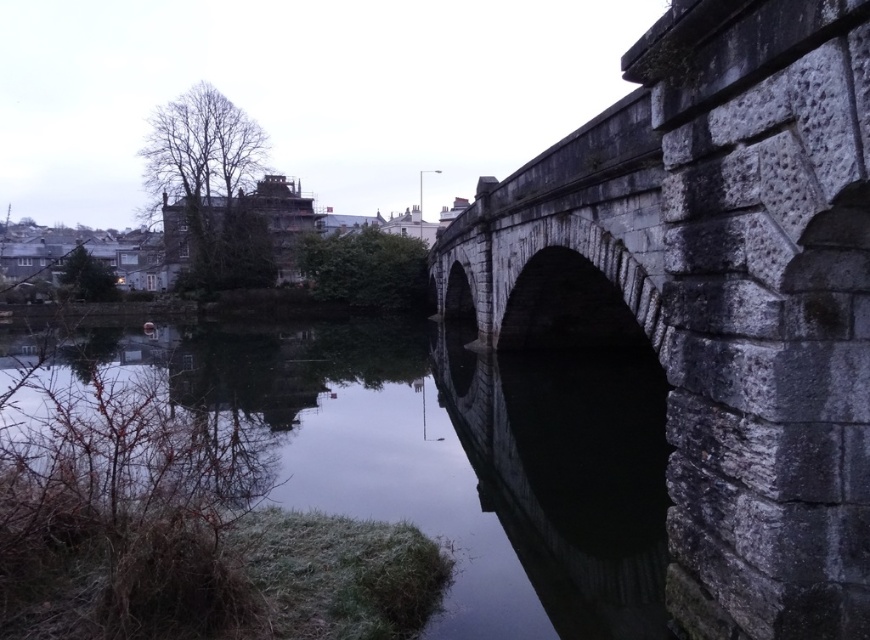
Can you confirm if gray stone bridge at right is taller than dark gray stone river at center?

Yes.

Is point (697, 36) positioned before point (628, 369)?

Yes, point (697, 36) is closer to viewer.

Locate an element on the screen. gray stone bridge at right is located at coordinates (715, 294).